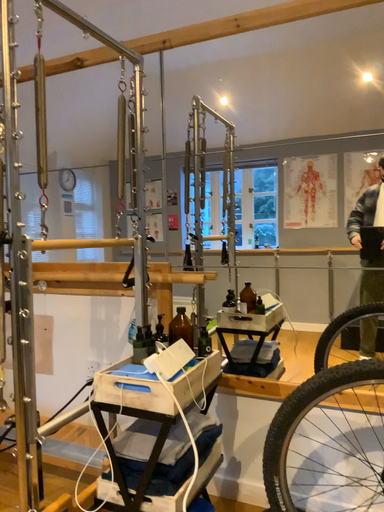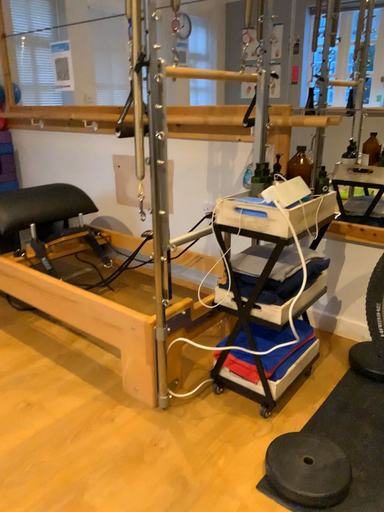
Question: How did the camera likely rotate when shooting the video?

Choices:
 (A) rotated downward
 (B) rotated upward

Answer: (A)